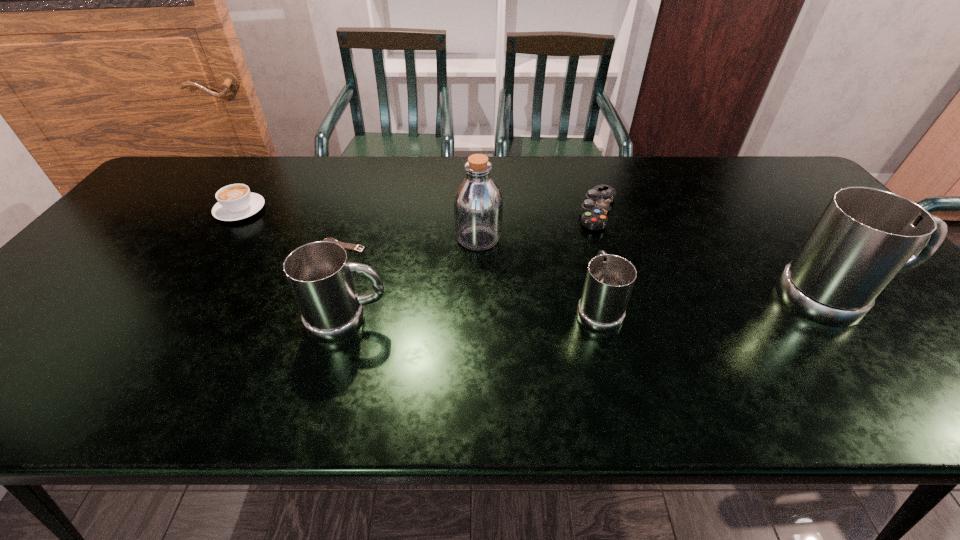
Where is `the second shortest mug`? the second shortest mug is located at coordinates (320, 276).

Image resolution: width=960 pixels, height=540 pixels. I want to click on the leftmost mug, so click(320, 276).

Image resolution: width=960 pixels, height=540 pixels. In order to click on the shortest mug in this screenshot , I will do `click(609, 281)`.

Image resolution: width=960 pixels, height=540 pixels. What are the coordinates of `the second mug from left to right` in the screenshot? It's located at (609, 281).

The image size is (960, 540). Identify the location of the tallest mug. (865, 236).

You are a GUI agent. You are given a task and a screenshot of the screen. Output one action in this format:
    pyautogui.click(x=<x>, y=<y>)
    Task: Click on the rightmost object
    
    Given the screenshot: What is the action you would take?
    pyautogui.click(x=865, y=236)

At what (x,y) coordinates should I click in order to perform the action: click on the shortest object. Please return your answer as a coordinate pair (x, y). Looking at the image, I should click on (349, 246).

The width and height of the screenshot is (960, 540). In order to click on control in this screenshot , I will do `click(594, 209)`.

This screenshot has width=960, height=540. In order to click on the third shortest object in this screenshot , I will do `click(235, 202)`.

What are the coordinates of `the leftmost object` in the screenshot? It's located at (235, 202).